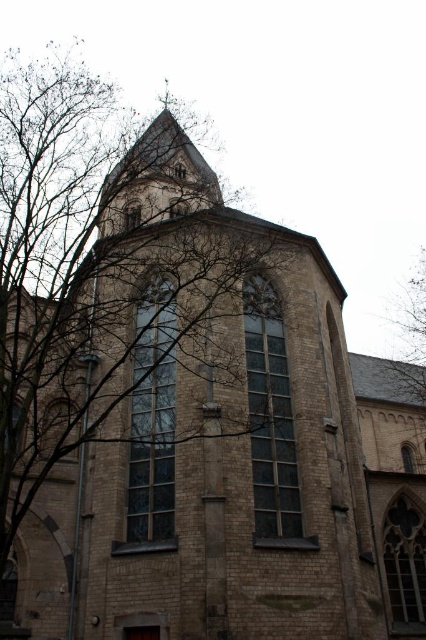
Question: Can you confirm if clear glass window at center is smaller than stained glass window at center?

Choices:
 (A) no
 (B) yes

Answer: (A)

Question: Based on their relative distances, which object is nearer to the green leafy tree at upper left?

Choices:
 (A) stained glass window at center
 (B) clear glass window at center
 (C) clear glass window at lower right

Answer: (C)

Question: Does stained glass window at center have a lesser width compared to clear glass window at lower right?

Choices:
 (A) yes
 (B) no

Answer: (A)

Question: Which object is the closest to the clear glass window at lower right?

Choices:
 (A) stained glass window at center
 (B) green leafy tree at upper left
 (C) clear glass window at center

Answer: (A)

Question: Is clear glass window at center wider than clear glass window at lower right?

Choices:
 (A) no
 (B) yes

Answer: (A)

Question: Considering the real-world distances, which object is farthest from the green leafy tree at upper left?

Choices:
 (A) clear glass window at center
 (B) stained glass window at center
 (C) clear glass window at lower right

Answer: (A)